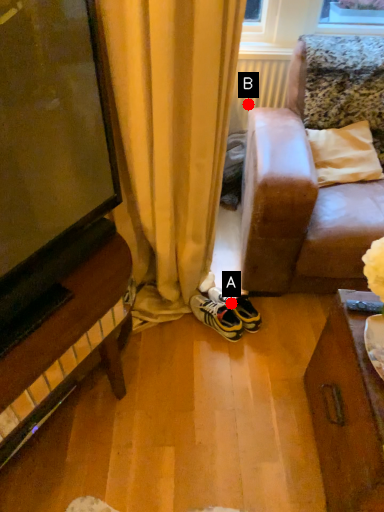
Question: Two points are circled on the image, labeled by A and B beside each circle. Which point is closer to the camera?

Choices:
 (A) A is closer
 (B) B is closer

Answer: (A)